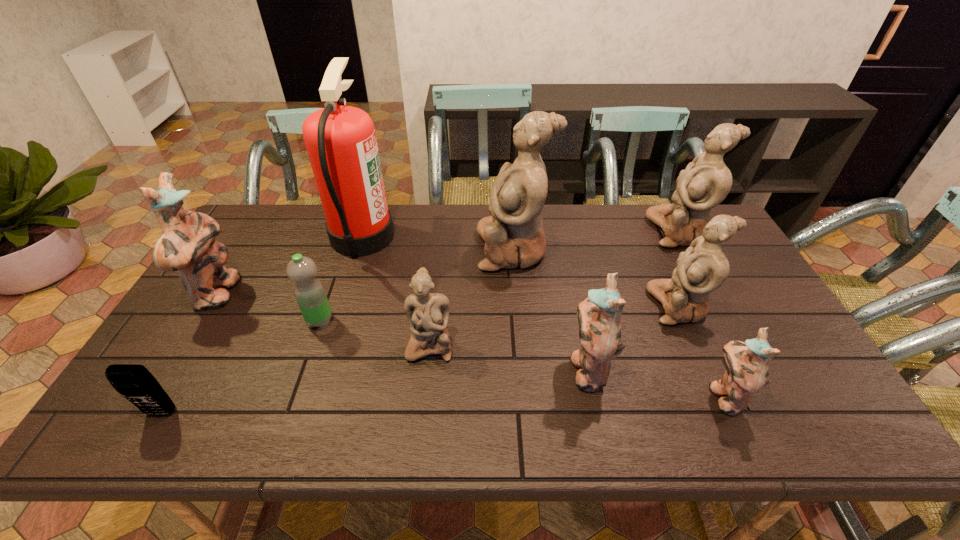
This screenshot has width=960, height=540. I want to click on free space located on the front-facing side of the smallest pink figurine, so click(x=641, y=396).

Where is `free space located on the front-facing side of the smallest pink figurine`? This screenshot has height=540, width=960. free space located on the front-facing side of the smallest pink figurine is located at coordinates (654, 396).

The image size is (960, 540). What are the coordinates of `vacant region located on the screen of the cellular telephone` in the screenshot? It's located at (145, 441).

Identify the location of fire extinguisher present at the far edge. (341, 143).

In order to click on figurine that is at the near edge in this screenshot , I will do `click(747, 373)`.

The width and height of the screenshot is (960, 540). I want to click on cellular telephone located at the near edge, so click(134, 382).

Where is `figurine that is at the left edge`? figurine that is at the left edge is located at coordinates (187, 244).

Locate an element on the screen. The image size is (960, 540). cellular telephone at the left edge is located at coordinates (134, 382).

Where is `object present at the right edge`? This screenshot has width=960, height=540. object present at the right edge is located at coordinates (706, 181).

Find the location of a particular element. object present at the near left corner is located at coordinates click(134, 382).